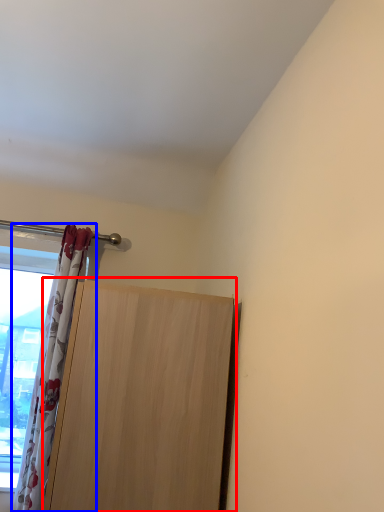
Question: Which of the following is the farthest to the observer, door (highlighted by a red box) or curtain (highlighted by a blue box)?

Choices:
 (A) door
 (B) curtain

Answer: (B)